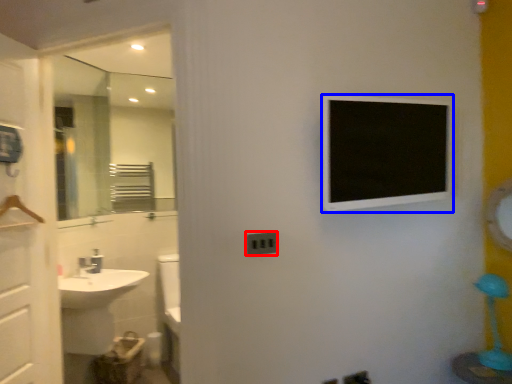
Question: Which of the following is the closest to the observer, electric outlet (highlighted by a red box) or medicine cabinet (highlighted by a blue box)?

Choices:
 (A) electric outlet
 (B) medicine cabinet

Answer: (B)